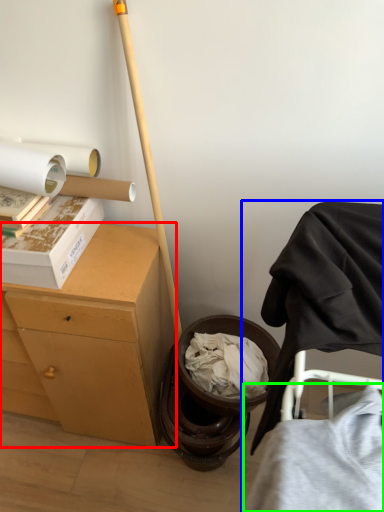
Question: Estimate the real-world distances between objects in this image. Which object is farther from desk (highlighted by a red box), furniture (highlighted by a blue box) or clothing (highlighted by a green box)?

Choices:
 (A) furniture
 (B) clothing

Answer: (B)